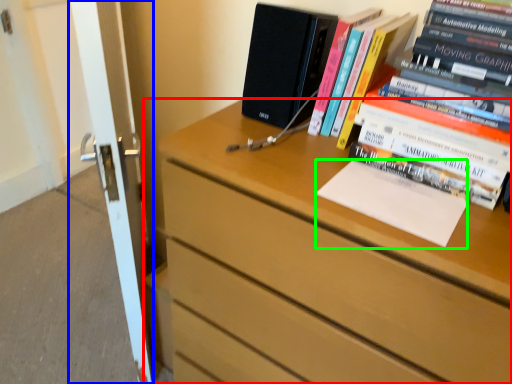
Question: Estimate the real-world distances between objects in this image. Which object is farther from chest of drawers (highlighted by a red box), screen door (highlighted by a blue box) or paperback book (highlighted by a green box)?

Choices:
 (A) screen door
 (B) paperback book

Answer: (A)